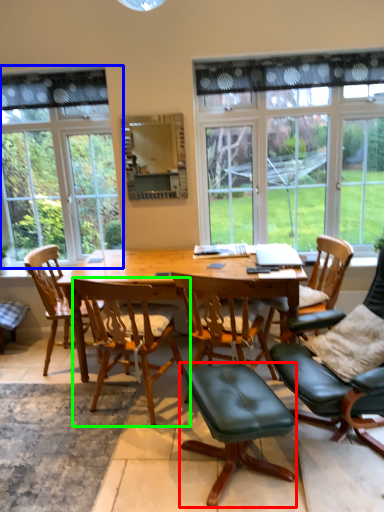
Question: Which is farther away from stool (highlighted by a red box)? window (highlighted by a blue box) or chair (highlighted by a green box)?

Choices:
 (A) window
 (B) chair

Answer: (A)